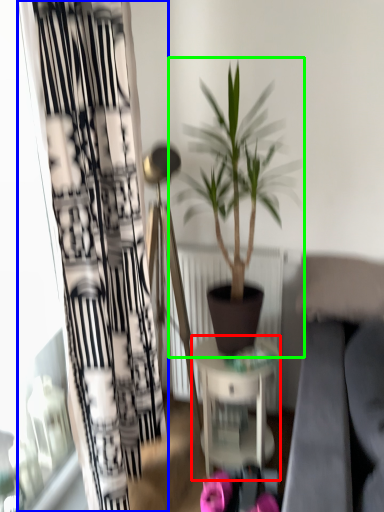
Question: Which is nearer to the table (highlighted by a red box)? curtain (highlighted by a blue box) or houseplant (highlighted by a green box).

Choices:
 (A) curtain
 (B) houseplant

Answer: (B)